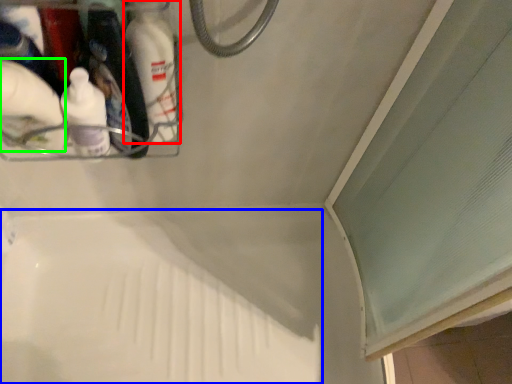
Question: Estimate the real-world distances between objects in this image. Which object is farther from bottle (highlighted by a red box), bath (highlighted by a blue box) or cleaning product (highlighted by a green box)?

Choices:
 (A) bath
 (B) cleaning product

Answer: (A)